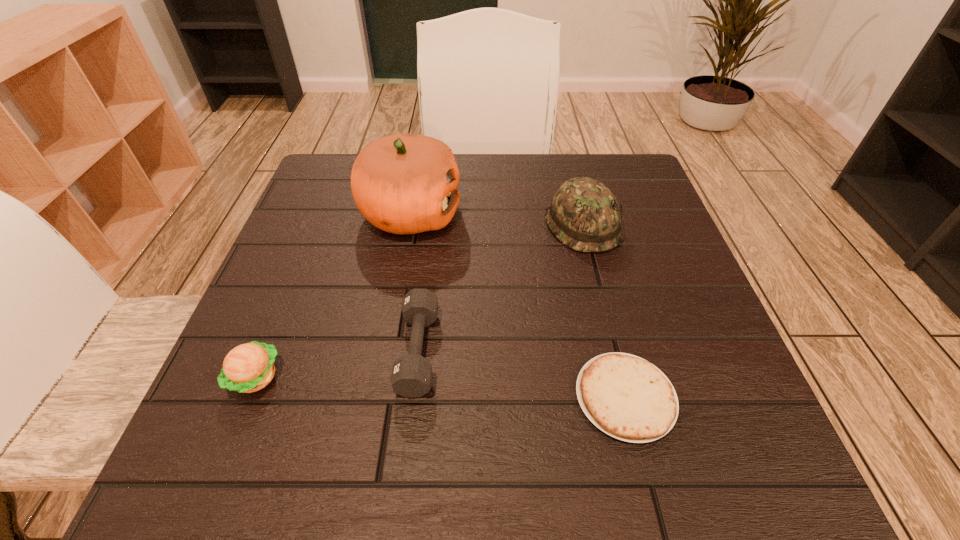
Locate an element on the screen. Image resolution: width=960 pixels, height=540 pixels. unoccupied area between the dumbbell and the tortilla is located at coordinates (521, 374).

The height and width of the screenshot is (540, 960). I want to click on vacant area that lies between the leftmost object and the dumbbell, so click(337, 363).

Locate an element on the screen. The image size is (960, 540). free space between the tallest object and the shortest object is located at coordinates (517, 306).

At what (x,y) coordinates should I click in order to perform the action: click on free point between the leftmost object and the tortilla. Please return your answer as a coordinate pair (x, y). This screenshot has width=960, height=540. Looking at the image, I should click on (441, 387).

The image size is (960, 540). I want to click on free area in between the headwear and the dumbbell, so pos(500,287).

Where is `vacant space that is in between the pumpkin and the fourth shortest object`? The width and height of the screenshot is (960, 540). vacant space that is in between the pumpkin and the fourth shortest object is located at coordinates (496, 219).

Locate which object ranks second in proximity to the tallest object. Please provide its 2D coordinates. Your answer should be formatted as a tuple, i.e. [(x, y)], where the tuple contains the x and y coordinates of a point satisfying the conditions above.

[(584, 215)]

Locate an element on the screen. Image resolution: width=960 pixels, height=540 pixels. the second closest object relative to the tallest object is located at coordinates (584, 215).

Locate an element on the screen. This screenshot has width=960, height=540. free spot that satisfies the following two spatial constraints: 1. on the back side of the hamburger; 2. on the right side of the second tallest object is located at coordinates (317, 225).

Where is `vacant area that satisfies the following two spatial constraints: 1. on the face of the fourth shortest object; 2. on the left side of the tallest object`? vacant area that satisfies the following two spatial constraints: 1. on the face of the fourth shortest object; 2. on the left side of the tallest object is located at coordinates coord(409,225).